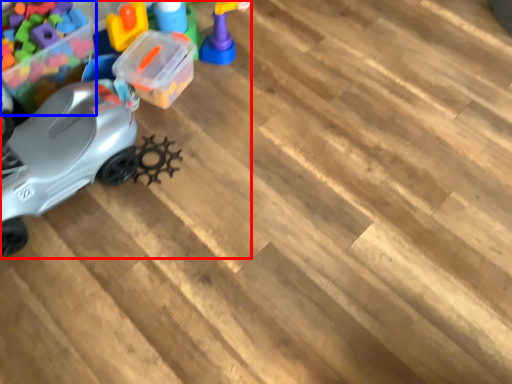
Question: Which point is further to the camera, toy (highlighted by a red box) or toy (highlighted by a blue box)?

Choices:
 (A) toy
 (B) toy

Answer: (B)